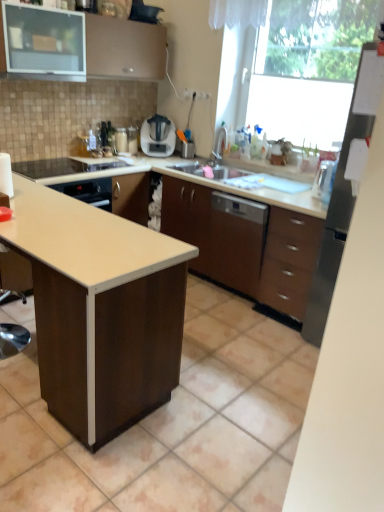
You are a GUI agent. You are given a task and a screenshot of the screen. Output one action in this format:
    pyautogui.click(x=<x>, y=<y>)
    Task: Click on the brown matte cabinet at center, acting as the 2th cabinetry starting from the left
    
    Given the screenshot: What is the action you would take?
    pyautogui.click(x=246, y=244)

Where is `satin nickel faucet at upper right`? Image resolution: width=384 pixels, height=512 pixels. satin nickel faucet at upper right is located at coordinates (220, 142).

Describe the element at coordinates (86, 239) in the screenshot. This screenshot has width=384, height=512. I see `beige laminate countertop at center` at that location.

This screenshot has width=384, height=512. What are the coordinates of `white laminate table at center` in the screenshot? It's located at (100, 309).

Find the location of a particular element. The image size is (384, 512). stainless steel refrigerator at right is located at coordinates (343, 193).

From a real-world perspective, is transparent glass window at upper right physically located above or below brown matte cabinet at center, acting as the 2th cabinetry starting from the left?

transparent glass window at upper right is situated higher than brown matte cabinet at center, acting as the 2th cabinetry starting from the left, in the real world.

From the image's perspective, would you say transparent glass window at upper right is positioned over brown matte cabinet at center, the 2th cabinetry when ordered from top to bottom?

Indeed, from the image's perspective, transparent glass window at upper right is shown above brown matte cabinet at center, the 2th cabinetry when ordered from top to bottom.

Is transparent glass window at upper right beside brown matte cabinet at center, acting as the 2th cabinetry starting from the left?

No, transparent glass window at upper right is not making contact with brown matte cabinet at center, acting as the 2th cabinetry starting from the left.

In the scene shown: Can you confirm if transparent glass window at upper right is shorter than brown matte cabinet at center, acting as the 2th cabinetry starting from the left?

Incorrect, the height of transparent glass window at upper right does not fall short of that of brown matte cabinet at center, acting as the 2th cabinetry starting from the left.

Is transparent glass window at upper right inside or outside of satin nickel faucet at upper right?

The correct answer is: outside.

Considering the relative sizes of transparent glass window at upper right and satin nickel faucet at upper right in the image provided, is transparent glass window at upper right bigger than satin nickel faucet at upper right?

Correct, transparent glass window at upper right is larger in size than satin nickel faucet at upper right.

Does transparent glass window at upper right have a lesser width compared to satin nickel faucet at upper right?

In fact, transparent glass window at upper right might be wider than satin nickel faucet at upper right.

Are transparent glass window at upper right and satin nickel faucet at upper right making contact?

transparent glass window at upper right and satin nickel faucet at upper right are clearly separated.

From the image's perspective, which object appears higher, satin silver blender at center or transparent glass window at upper right?

transparent glass window at upper right appears higher in the image.

From a real-world perspective, is satin silver blender at center on transparent glass window at upper right?

Actually, satin silver blender at center is physically below transparent glass window at upper right in the real world.

How different are the orientations of satin silver blender at center and transparent glass window at upper right in degrees?

The angular difference between satin silver blender at center and transparent glass window at upper right is 138 degrees.

Is satin silver blender at center to the left or to the right of transparent glass window at upper right in the image?

Based on their positions, satin silver blender at center is located to the left of transparent glass window at upper right.

Does point (251, 222) come farther from viewer compared to point (219, 133)?

No, (251, 222) is closer to viewer.

Is brown matte cabinet at center, the first cabinetry when ordered from bottom to top, closer to the viewer compared to satin nickel faucet at upper right?

Yes, brown matte cabinet at center, the first cabinetry when ordered from bottom to top, is closer to the viewer.

Could you tell me if brown matte cabinet at center, the first cabinetry when ordered from bottom to top, is turned towards satin nickel faucet at upper right?

No, brown matte cabinet at center, the first cabinetry when ordered from bottom to top, is not turned towards satin nickel faucet at upper right.

From the image's perspective, is brown matte cabinet at center, the first cabinetry from the right, over satin nickel faucet at upper right?

No, from the image's perspective, brown matte cabinet at center, the first cabinetry from the right, is not above satin nickel faucet at upper right.

Which is more distant, (214,150) or (158,264)?

The point (214,150) is more distant.

In the scene shown: Is satin nickel faucet at upper right facing towards beige laminate countertop at center?

No, satin nickel faucet at upper right is not aimed at beige laminate countertop at center.

Is satin nickel faucet at upper right to the left or to the right of beige laminate countertop at center in the image?

Based on their positions, satin nickel faucet at upper right is located to the right of beige laminate countertop at center.

From a real-world perspective, which is physically below, satin nickel faucet at upper right or beige laminate countertop at center?

In real-world perspective, beige laminate countertop at center is lower.

Measure the distance between stainless steel refrigerator at right and brown matte cabinet at center, the 2th cabinetry when ordered from top to bottom.

stainless steel refrigerator at right and brown matte cabinet at center, the 2th cabinetry when ordered from top to bottom, are 23.74 inches apart from each other.

Looking at this image, is stainless steel refrigerator at right positioned far away from brown matte cabinet at center, the first cabinetry when ordered from bottom to top?

No, stainless steel refrigerator at right is in close proximity to brown matte cabinet at center, the first cabinetry when ordered from bottom to top.

Does stainless steel refrigerator at right turn towards brown matte cabinet at center, the first cabinetry when ordered from bottom to top?

No, stainless steel refrigerator at right does not turn towards brown matte cabinet at center, the first cabinetry when ordered from bottom to top.

Considering the relative sizes of stainless steel refrigerator at right and brown matte cabinet at center, the 2th cabinetry when ordered from top to bottom, in the image provided, is stainless steel refrigerator at right shorter than brown matte cabinet at center, the 2th cabinetry when ordered from top to bottom,?

No.

Considering the positions of objects matte brown cabinet at upper left, which is the 2th cabinetry from bottom to top, and stainless steel refrigerator at right in the image provided, who is behind, matte brown cabinet at upper left, which is the 2th cabinetry from bottom to top, or stainless steel refrigerator at right?

matte brown cabinet at upper left, which is the 2th cabinetry from bottom to top, is further from the camera.

Is point (97, 29) positioned in front of point (314, 314)?

That is False.

Based on the photo, is there a large distance between matte brown cabinet at upper left, which is the 2th cabinetry from bottom to top, and stainless steel refrigerator at right?

matte brown cabinet at upper left, which is the 2th cabinetry from bottom to top, is far away from stainless steel refrigerator at right.

Is matte brown cabinet at upper left, positioned as the first cabinetry in top-to-bottom order, oriented towards stainless steel refrigerator at right?

No, matte brown cabinet at upper left, positioned as the first cabinetry in top-to-bottom order, is not turned towards stainless steel refrigerator at right.

You are a GUI agent. You are given a task and a screenshot of the screen. Output one action in this format:
    pyautogui.click(x=<x>, y=<y>)
    Task: Click on the 1st cabinetry in front of the transparent glass window at upper right, starting your count from the anchor
    
    Given the screenshot: What is the action you would take?
    [246, 244]

Locate an element on the screen. window screen that is above the satin nickel faucet at upper right (from a real-world perspective) is located at coordinates (309, 68).

Which object lies nearer to the anchor point white laminate table at center, satin silver blender at center or satin nickel faucet at upper right?

satin silver blender at center is positioned closer to the anchor white laminate table at center.

Which object lies nearer to the anchor point stainless steel refrigerator at right, beige laminate countertop at center or white laminate table at center?

beige laminate countertop at center is closer to stainless steel refrigerator at right.

Considering their positions, is white laminate table at center positioned further to satin silver blender at center than transparent glass window at upper right?

white laminate table at center lies further to satin silver blender at center than the other object.

From the image, which object appears to be farther from matte brown cabinet at upper left, which is the 2th cabinetry from bottom to top, white laminate table at center or satin nickel faucet at upper right?

The object further to matte brown cabinet at upper left, which is the 2th cabinetry from bottom to top, is white laminate table at center.

From the image, which object appears to be nearer to matte brown cabinet at upper left, positioned as the first cabinetry in top-to-bottom order, satin nickel faucet at upper right or brown matte cabinet at center, the first cabinetry when ordered from bottom to top?

satin nickel faucet at upper right is positioned closer to the anchor matte brown cabinet at upper left, positioned as the first cabinetry in top-to-bottom order.

Based on their spatial positions, is stainless steel refrigerator at right or beige laminate countertop at center closer to transparent glass window at upper right?

Based on the image, stainless steel refrigerator at right appears to be nearer to transparent glass window at upper right.

From the image, which object appears to be nearer to transparent glass window at upper right, satin nickel faucet at upper right or matte brown cabinet at upper left, positioned as the first cabinetry in top-to-bottom order?

satin nickel faucet at upper right is positioned closer to the anchor transparent glass window at upper right.

Estimate the real-world distances between objects in this image. Which object is further from satin silver blender at center, stainless steel refrigerator at right or satin nickel faucet at upper right?

The object further to satin silver blender at center is stainless steel refrigerator at right.

Identify the location of table situated between beige laminate countertop at center and brown matte cabinet at center, the 2th cabinetry when ordered from top to bottom, from left to right. (100, 309).

I want to click on window screen located between white laminate table at center and satin silver blender at center in the depth direction, so click(309, 68).

The height and width of the screenshot is (512, 384). I want to click on home appliance between matte brown cabinet at upper left, positioned as the first cabinetry in top-to-bottom order, and stainless steel refrigerator at right, so click(x=158, y=136).

Where is `home appliance located between beige laminate countertop at center and brown matte cabinet at center, the first cabinetry from the right, in the left-right direction`? The image size is (384, 512). home appliance located between beige laminate countertop at center and brown matte cabinet at center, the first cabinetry from the right, in the left-right direction is located at coordinates (158, 136).